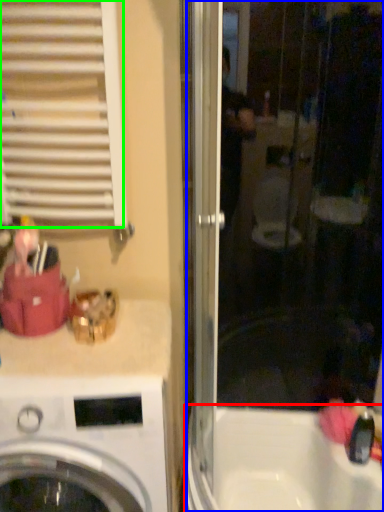
Question: Which is nearer to the bath (highlighted by a red box)? screen door (highlighted by a blue box) or shutter (highlighted by a green box).

Choices:
 (A) screen door
 (B) shutter

Answer: (A)